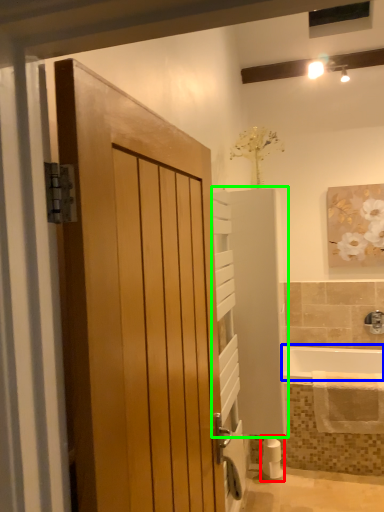
Question: Which object is the closest to the toilet paper (highlighted by a red box)? Choose among these: bath (highlighted by a blue box) or elevator (highlighted by a green box).

Choices:
 (A) bath
 (B) elevator

Answer: (A)